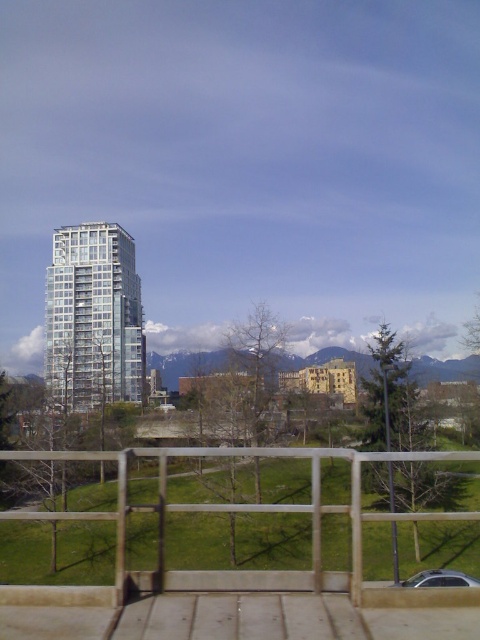
Question: Observing the image, what is the correct spatial positioning of wooden at lower center in reference to clear glass building at center?

Choices:
 (A) below
 (B) above

Answer: (A)

Question: Which point is closer to the camera taking this photo?

Choices:
 (A) (110, 396)
 (B) (402, 625)

Answer: (B)

Question: Is wooden at lower center positioned behind clear glass building at center?

Choices:
 (A) no
 (B) yes

Answer: (A)

Question: Which object appears closest to the camera in this image?

Choices:
 (A) wooden at lower center
 (B) clear glass building at center

Answer: (A)

Question: From the image, what is the correct spatial relationship of wooden at lower center in relation to clear glass building at center?

Choices:
 (A) left
 (B) right

Answer: (B)